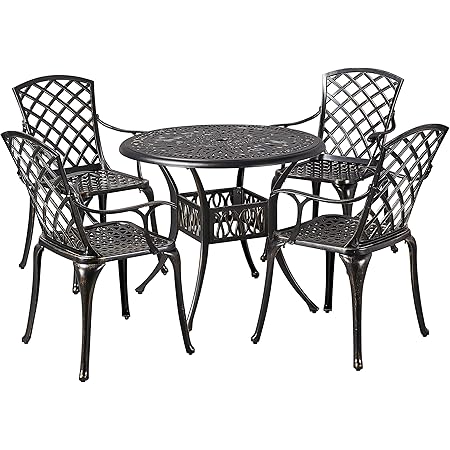
Locate an element on the screen. This screenshot has width=450, height=450. back right chair is located at coordinates (340, 148).